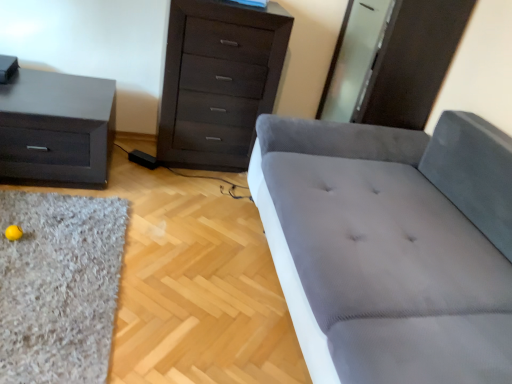
Identify the location of shaggy gray rug at lower left. (59, 286).

The height and width of the screenshot is (384, 512). What do you see at coordinates (56, 128) in the screenshot?
I see `matte black nightstand at left` at bounding box center [56, 128].

What are the coordinates of `dark wood chest of drawers at upper center` in the screenshot? It's located at (218, 81).

Identify the location of gray fabric studio couch at center. This screenshot has height=384, width=512. (391, 246).

Is point (42, 141) more distant than point (211, 34)?

No, (42, 141) is closer to viewer.

Are matte black nightstand at left and dark wood chest of drawers at upper center making contact?

There is a gap between matte black nightstand at left and dark wood chest of drawers at upper center.

How far apart are matte black nightstand at left and dark wood chest of drawers at upper center?

matte black nightstand at left and dark wood chest of drawers at upper center are 22.53 inches apart from each other.

Looking at their sizes, would you say matte black nightstand at left is wider or thinner than dark wood chest of drawers at upper center?

In the image, matte black nightstand at left appears to be wider than dark wood chest of drawers at upper center.

Could you tell me if gray fabric studio couch at center is facing matte black nightstand at left?

Yes, gray fabric studio couch at center is oriented towards matte black nightstand at left.

What's the angular difference between gray fabric studio couch at center and matte black nightstand at left's facing directions?

gray fabric studio couch at center and matte black nightstand at left are facing 89.6 degrees away from each other.

Which is less distant, (357, 142) or (100, 121)?

The point (100, 121) is closer to the camera.

Can you confirm if gray fabric studio couch at center is thinner than matte black nightstand at left?

Incorrect, the width of gray fabric studio couch at center is not less than that of matte black nightstand at left.

From the picture: From the image's perspective, does dark wood chest of drawers at upper center appear higher than matte black nightstand at left?

Yes, from the image's perspective, dark wood chest of drawers at upper center is on top of matte black nightstand at left.

Is dark wood chest of drawers at upper center in front of or behind matte black nightstand at left in the image?

dark wood chest of drawers at upper center is positioned farther from the viewer than matte black nightstand at left.

Measure the distance between dark wood chest of drawers at upper center and matte black nightstand at left.

A distance of 57.21 centimeters exists between dark wood chest of drawers at upper center and matte black nightstand at left.

Considering the points (260, 32) and (111, 104), which point is behind, point (260, 32) or point (111, 104)?

The point (111, 104) is farther.

From the image's perspective, relative to dark wood chest of drawers at upper center, is gray fabric studio couch at center above or below?

Based on their image positions, gray fabric studio couch at center is located beneath dark wood chest of drawers at upper center.

Can you confirm if gray fabric studio couch at center is positioned to the left of dark wood chest of drawers at upper center?

No, gray fabric studio couch at center is not to the left of dark wood chest of drawers at upper center.

How different are the orientations of gray fabric studio couch at center and dark wood chest of drawers at upper center in degrees?

There is a 90.8-degree angle between the facing directions of gray fabric studio couch at center and dark wood chest of drawers at upper center.

Does gray fabric studio couch at center have a greater height compared to dark wood chest of drawers at upper center?

No, gray fabric studio couch at center is not taller than dark wood chest of drawers at upper center.

Considering the relative sizes of shaggy gray rug at lower left and matte black nightstand at left in the image provided, is shaggy gray rug at lower left thinner than matte black nightstand at left?

Yes, shaggy gray rug at lower left is thinner than matte black nightstand at left.

Does shaggy gray rug at lower left have a larger size compared to matte black nightstand at left?

Actually, shaggy gray rug at lower left might be smaller than matte black nightstand at left.

From a real-world perspective, is shaggy gray rug at lower left on top of matte black nightstand at left?

Actually, shaggy gray rug at lower left is physically below matte black nightstand at left in the real world.

Which is closer, (106, 280) or (78, 156)?

The point (106, 280) is closer.

Choose the correct answer: Is gray fabric studio couch at center inside shaggy gray rug at lower left or outside it?

gray fabric studio couch at center is outside shaggy gray rug at lower left.

Is gray fabric studio couch at center in front of or behind shaggy gray rug at lower left in the image?

gray fabric studio couch at center is in front of shaggy gray rug at lower left.

In order to click on studio couch above the shaggy gray rug at lower left (from the image's perspective) in this screenshot , I will do `click(391, 246)`.

Does point (210, 106) appear closer or farther from the camera than point (508, 341)?

Clearly, point (210, 106) is more distant from the camera than point (508, 341).

From the image's perspective, would you say dark wood chest of drawers at upper center is shown under gray fabric studio couch at center?

No, from the image's perspective, dark wood chest of drawers at upper center is not below gray fabric studio couch at center.

Could you tell me if dark wood chest of drawers at upper center is facing gray fabric studio couch at center?

Yes.

The height and width of the screenshot is (384, 512). What are the coordinates of `the chest of drawers that is behind the matte black nightstand at left` in the screenshot? It's located at (218, 81).

In the image, there is a gray fabric studio couch at center. Where is `nightstand above it (from the image's perspective)`? The image size is (512, 384). nightstand above it (from the image's perspective) is located at coordinates (56, 128).

Considering their positions, is dark wood chest of drawers at upper center positioned closer to gray fabric studio couch at center than shaggy gray rug at lower left?

dark wood chest of drawers at upper center.

Looking at the image, which one is located further to dark wood chest of drawers at upper center, shaggy gray rug at lower left or gray fabric studio couch at center?

The object further to dark wood chest of drawers at upper center is shaggy gray rug at lower left.

Estimate the real-world distances between objects in this image. Which object is further from shaggy gray rug at lower left, gray fabric studio couch at center or matte black nightstand at left?

Based on the image, gray fabric studio couch at center appears to be further to shaggy gray rug at lower left.

Based on their spatial positions, is shaggy gray rug at lower left or matte black nightstand at left closer to gray fabric studio couch at center?

shaggy gray rug at lower left lies closer to gray fabric studio couch at center than the other object.

Estimate the real-world distances between objects in this image. Which object is closer to gray fabric studio couch at center, matte black nightstand at left or dark wood chest of drawers at upper center?

Based on the image, dark wood chest of drawers at upper center appears to be nearer to gray fabric studio couch at center.

Which object lies nearer to the anchor point matte black nightstand at left, dark wood chest of drawers at upper center or gray fabric studio couch at center?

dark wood chest of drawers at upper center is closer to matte black nightstand at left.

When comparing their distances from shaggy gray rug at lower left, does matte black nightstand at left or dark wood chest of drawers at upper center seem closer?

matte black nightstand at left lies closer to shaggy gray rug at lower left than the other object.

When comparing their distances from dark wood chest of drawers at upper center, does gray fabric studio couch at center or matte black nightstand at left seem closer?

Among the two, matte black nightstand at left is located nearer to dark wood chest of drawers at upper center.

Identify the location of nightstand between dark wood chest of drawers at upper center and shaggy gray rug at lower left in the vertical direction. This screenshot has height=384, width=512. (56, 128).

Locate an element on the screen. mat between matte black nightstand at left and gray fabric studio couch at center in the horizontal direction is located at coordinates (59, 286).

The width and height of the screenshot is (512, 384). I want to click on the chest of drawers located between shaggy gray rug at lower left and gray fabric studio couch at center in the left-right direction, so click(x=218, y=81).

Find the location of `the chest of drawers situated between matte black nightstand at left and gray fabric studio couch at center from left to right`. the chest of drawers situated between matte black nightstand at left and gray fabric studio couch at center from left to right is located at coordinates (218, 81).